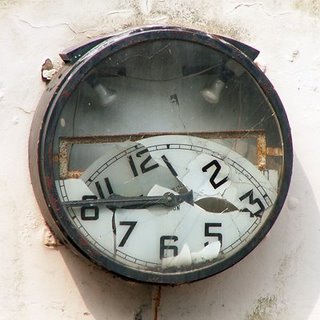
I want to click on glass, so click(x=217, y=107).